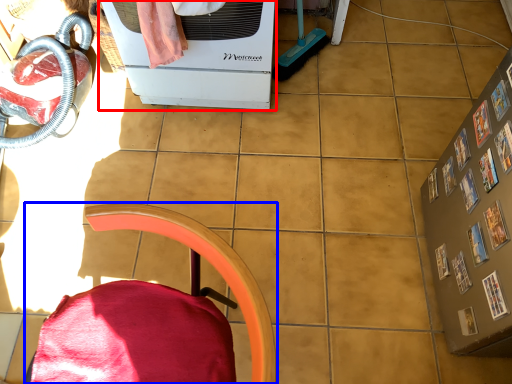
Question: Which point is closer to the camera, home appliance (highlighted by a red box) or furniture (highlighted by a blue box)?

Choices:
 (A) home appliance
 (B) furniture

Answer: (B)